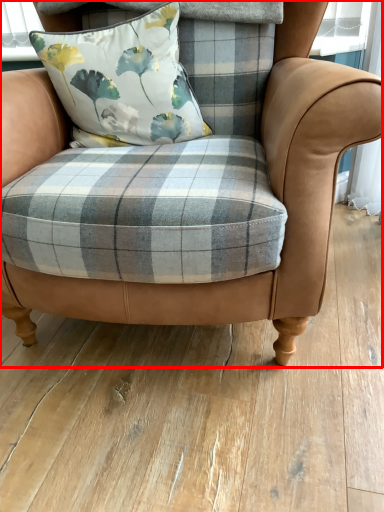
Question: Observing the image, what is the correct spatial positioning of chair (annotated by the red box) in reference to pillow?

Choices:
 (A) right
 (B) left

Answer: (A)